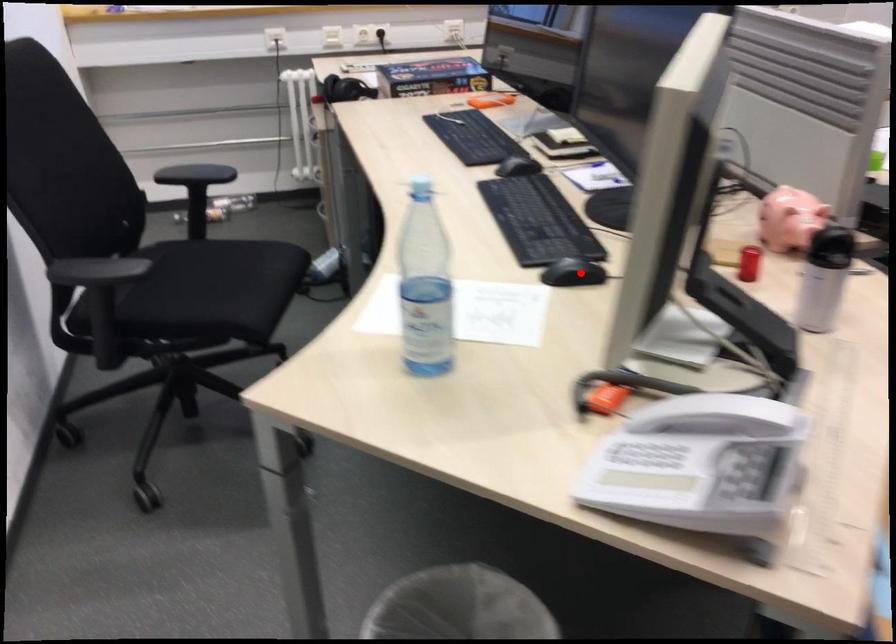
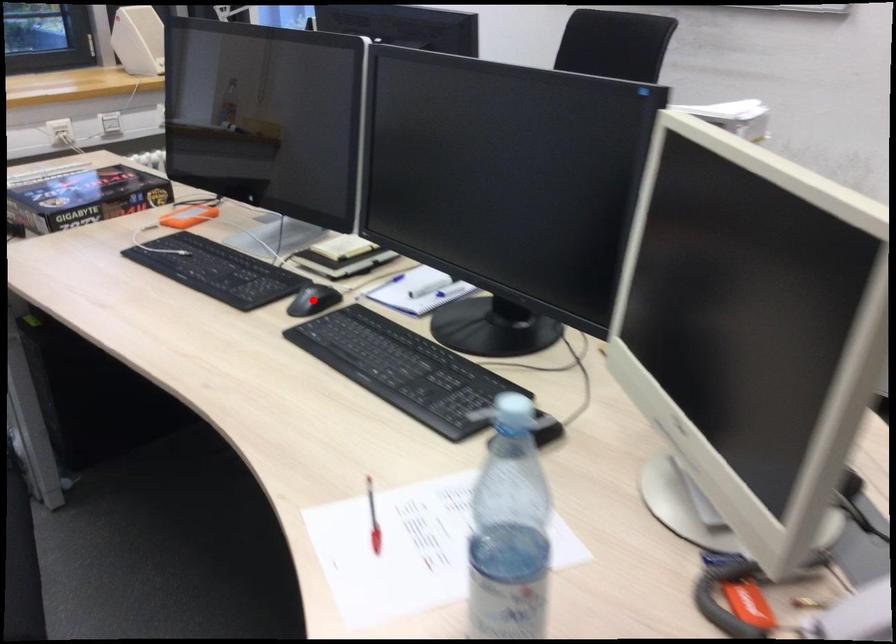
I am providing you with two images of the same scene from different viewpoints. A red point is marked on the first image and another point is marked on the second image. Is the marked point in image1 the same physical position as the marked point in image2?

No